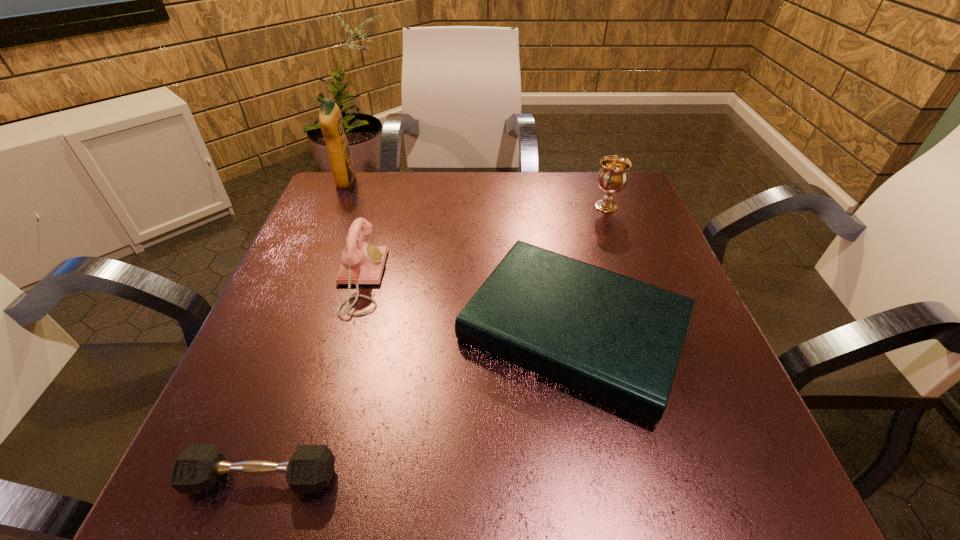
Locate an element on the screen. Image resolution: width=960 pixels, height=540 pixels. vacant space located 0.120m on the right of the dumbbell is located at coordinates (420, 478).

This screenshot has width=960, height=540. Find the location of `detergent that is positioned at the far edge`. detergent that is positioned at the far edge is located at coordinates (330, 119).

Identify the location of chalice present at the far edge. The height and width of the screenshot is (540, 960). (x=613, y=175).

This screenshot has width=960, height=540. I want to click on object situated at the near edge, so click(198, 468).

Locate an element on the screen. Image resolution: width=960 pixels, height=540 pixels. detergent that is at the left edge is located at coordinates (330, 119).

In order to click on telephone present at the left edge in this screenshot , I will do `click(362, 263)`.

The height and width of the screenshot is (540, 960). Find the location of `dumbbell present at the left edge`. dumbbell present at the left edge is located at coordinates (198, 468).

This screenshot has width=960, height=540. I want to click on chalice positioned at the right edge, so click(613, 175).

You are a GUI agent. You are given a task and a screenshot of the screen. Output one action in this format:
    pyautogui.click(x=<x>, y=<y>)
    Task: Click on the book present at the right edge
    The height and width of the screenshot is (540, 960).
    Given the screenshot: What is the action you would take?
    pyautogui.click(x=618, y=340)

This screenshot has width=960, height=540. Find the location of `object positioned at the far left corner`. object positioned at the far left corner is located at coordinates (330, 119).